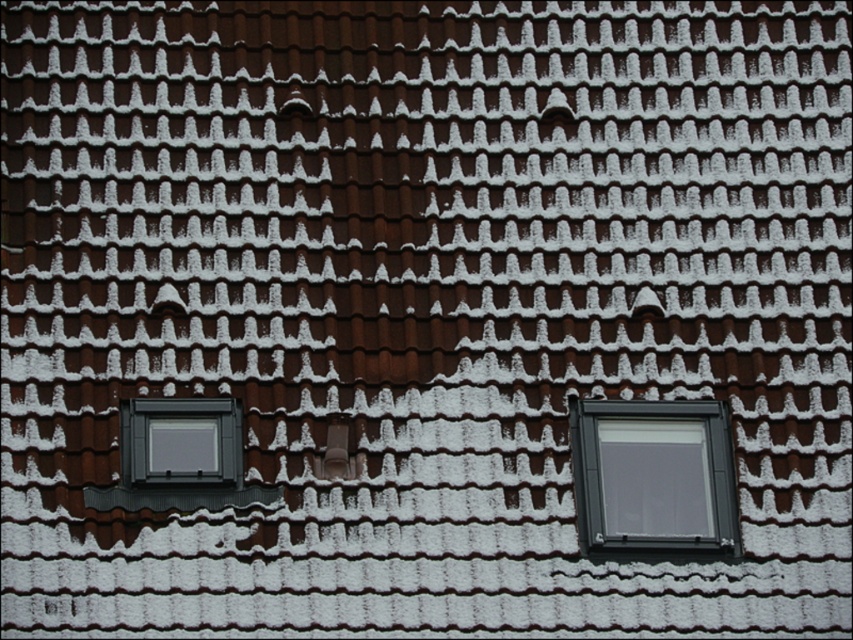
Question: Is matte gray window at right bigger than matte gray window at lower left?

Choices:
 (A) no
 (B) yes

Answer: (B)

Question: Among these objects, which one is farthest from the camera?

Choices:
 (A) matte gray window at right
 (B) matte gray window at lower left

Answer: (A)

Question: Which of the following is the farthest from the observer?

Choices:
 (A) matte gray window at lower left
 (B) matte gray window at right

Answer: (B)

Question: Is matte gray window at right in front of matte gray window at lower left?

Choices:
 (A) yes
 (B) no

Answer: (B)

Question: Is matte gray window at right to the right of matte gray window at lower left from the viewer's perspective?

Choices:
 (A) no
 (B) yes

Answer: (B)

Question: Among these points, which one is nearest to the camera?

Choices:
 (A) (160, 426)
 (B) (595, 404)

Answer: (A)